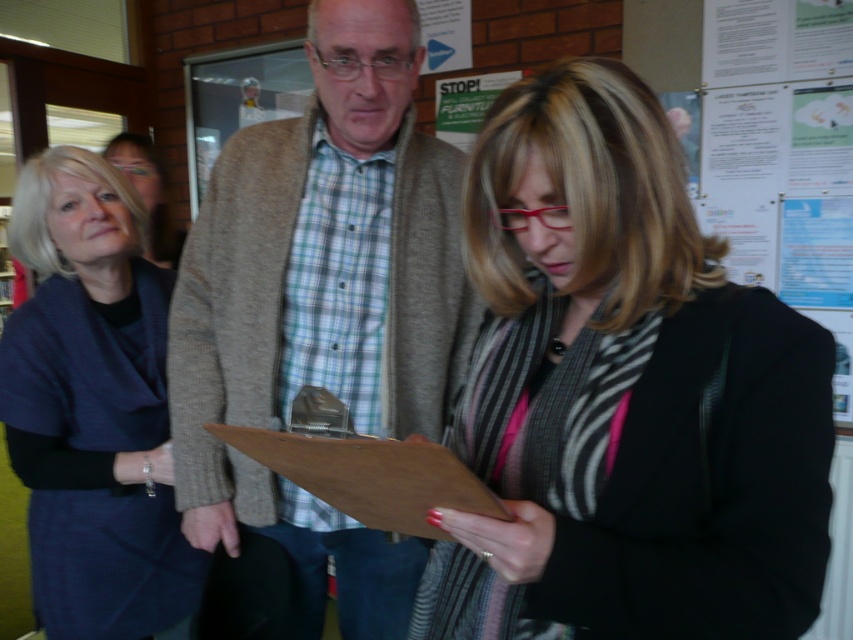
Which is more to the right, dark blue fabric dress at left or wooden clipboard at center?

From the viewer's perspective, wooden clipboard at center appears more on the right side.

Identify the location of dark blue fabric dress at left. (93, 406).

Which of these two, gray wool sweater at center or white paper poster at upper right, stands shorter?

gray wool sweater at center

Which is below, gray wool sweater at center or white paper poster at upper right?

Positioned lower is gray wool sweater at center.

Is point (207, 435) closer to viewer compared to point (763, 72)?

Yes, point (207, 435) is in front of point (763, 72).

The image size is (853, 640). In order to click on gray wool sweater at center in this screenshot , I will do `click(323, 307)`.

Between wooden clipboard at center and matte black dress at left, which one has more height?

Standing taller between the two is matte black dress at left.

Who is more distant from viewer, (479, 513) or (161, 168)?

Point (161, 168)

Measure the distance between wooden clipboard at center and camera.

wooden clipboard at center is 26.12 inches from camera.

Image resolution: width=853 pixels, height=640 pixels. In order to click on wooden clipboard at center in this screenshot , I will do `click(370, 476)`.